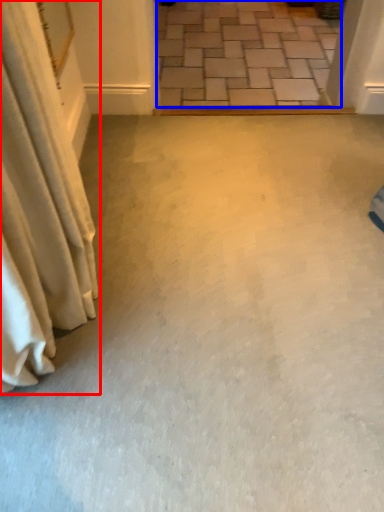
Question: Which point is further to the camera, curtain (highlighted by a red box) or concrete (highlighted by a blue box)?

Choices:
 (A) curtain
 (B) concrete

Answer: (B)